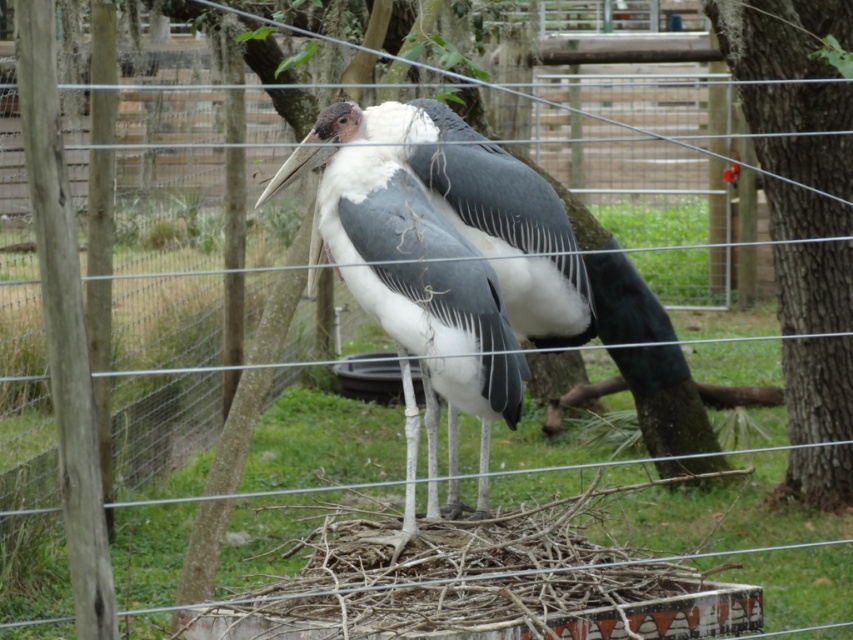
You are a park ranger observing the birds in the enclosure. You see the white feathered bird at center. What are its coordinates in the image?

The white feathered bird at center is located at coordinates (410, 269).

You are a zookeeper observing the enclosure. You need to determine if there is enough space to place a new feeding tray between the white feathered bird at center and the smooth bark tree at right. Based on their sizes, can the feeding tray fit?

The white feathered bird at center occupies less space than the smooth bark tree at right, so there should be sufficient space between them to place the feeding tray.